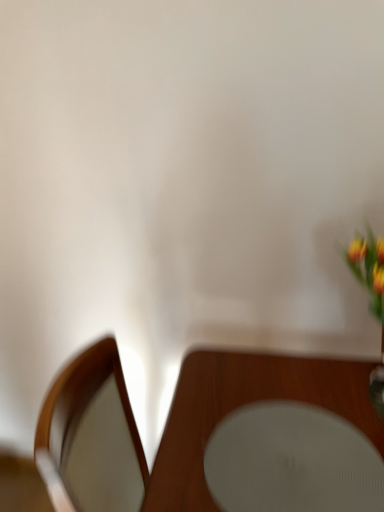
Question: Should I look upward or downward to see white matte plate at center?

Choices:
 (A) down
 (B) up

Answer: (A)